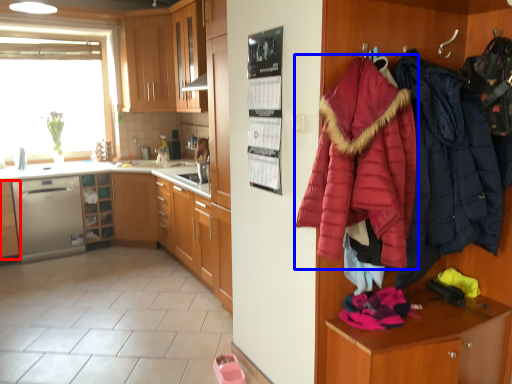
Question: Which of the following is the farthest to the observer, cabinetry (highlighted by a red box) or jacket (highlighted by a blue box)?

Choices:
 (A) cabinetry
 (B) jacket

Answer: (A)